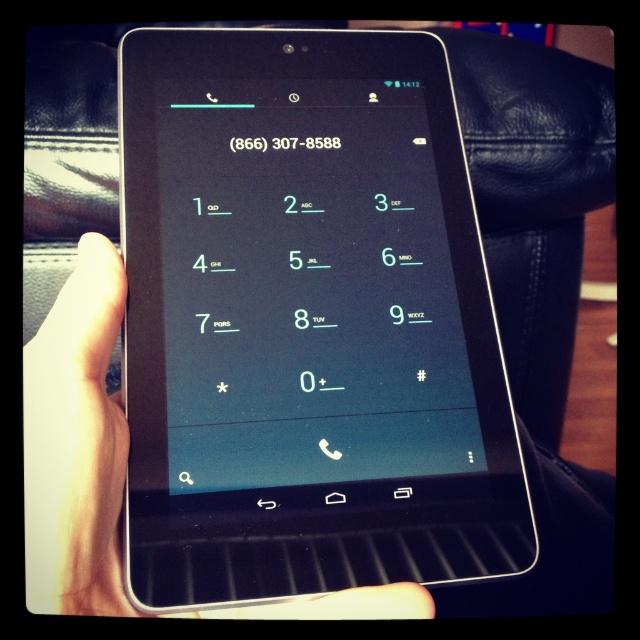
Between point (148, 419) and point (99, 545), which one is positioned in front?

Point (99, 545) is more forward.

This screenshot has height=640, width=640. What are the coordinates of `black glossy tablet at center` in the screenshot? It's located at (307, 323).